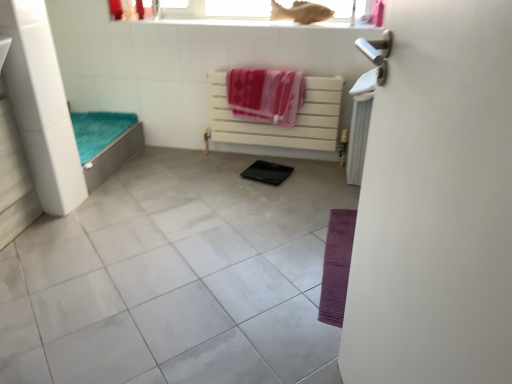
Locate an element on the screen. This screenshot has width=512, height=384. vacant region to the left of white plastic radiator at center is located at coordinates tap(198, 165).